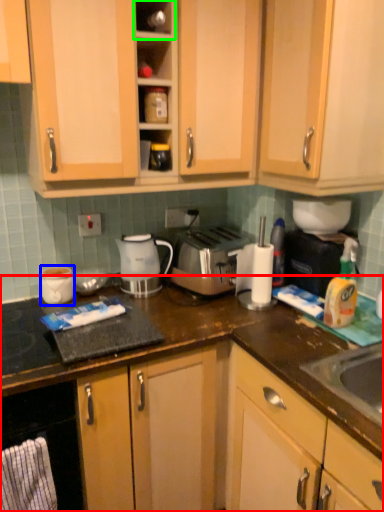
Question: Estimate the real-world distances between objects in this image. Which object is farther from cabinetry (highlighted by a red box), appliance (highlighted by a blue box) or shelf (highlighted by a green box)?

Choices:
 (A) appliance
 (B) shelf

Answer: (B)